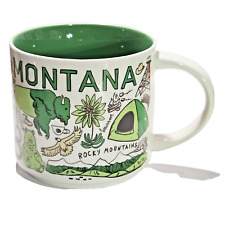
You are a GUI agent. You are given a task and a screenshot of the screen. Output one action in this format:
    pyautogui.click(x=<x>, y=<y>)
    Task: Click on the plant on white coffee cup
    Image resolution: width=225 pixels, height=225 pixels.
    Given the screenshot: What is the action you would take?
    pyautogui.click(x=91, y=111)